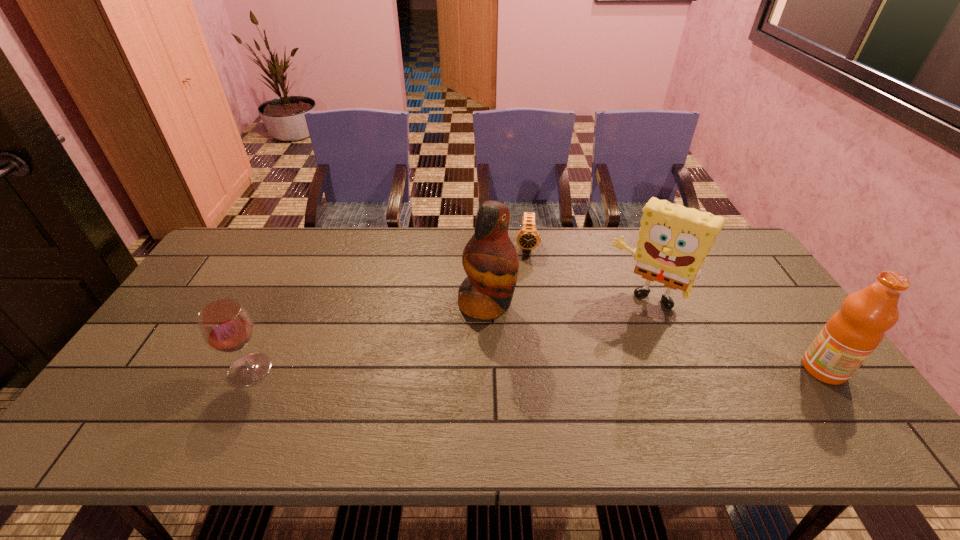
Locate an element on the screen. the leftmost object is located at coordinates (225, 325).

Where is `the fourth tallest object`? the fourth tallest object is located at coordinates (225, 325).

What are the coordinates of `fruit juice` in the screenshot? It's located at (848, 338).

I want to click on the fourth object from right to left, so click(x=490, y=260).

This screenshot has height=540, width=960. Find the location of `the tallest object`. the tallest object is located at coordinates (490, 260).

Identify the location of the third object from right to left. (528, 238).

Identify the location of the farthest object. [528, 238].

Locate an element on the screen. This screenshot has height=540, width=960. the second object from right to left is located at coordinates 674,241.

The height and width of the screenshot is (540, 960). What are the coordinates of `vacant area situated 0.310m on the back of the wineglass` in the screenshot? It's located at (296, 276).

Locate an element on the screen. vacant space located on the face of the tallest object is located at coordinates (583, 355).